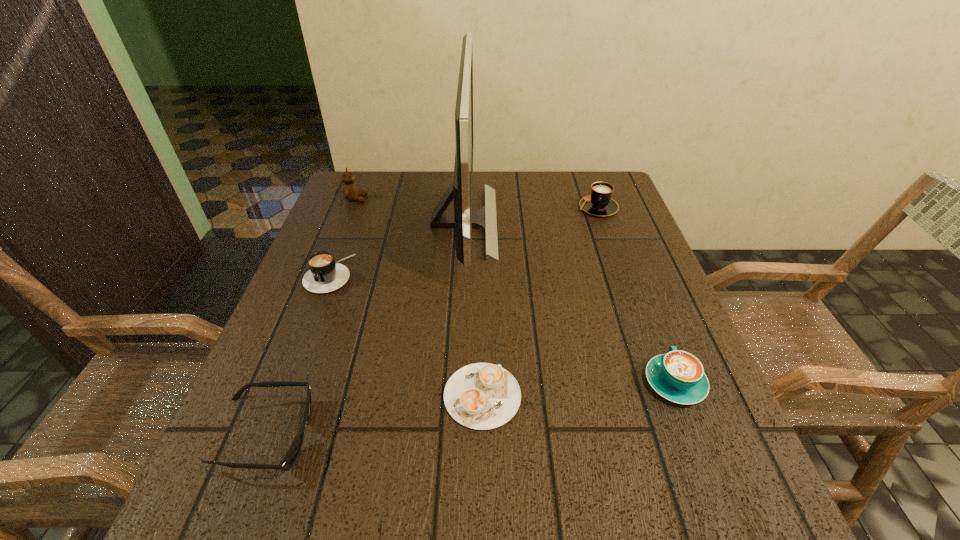
The height and width of the screenshot is (540, 960). I want to click on free region located 0.190m on the front of the farthest cappuccino, so pos(618,266).

The image size is (960, 540). In order to click on vacant space located 0.090m with the handle on the side of the second farthest cappuccino in this screenshot , I will do `click(309, 327)`.

This screenshot has width=960, height=540. I want to click on free space located with the handle on the right side of the second shortest cappuccino, so click(641, 295).

Identify the location of free point located with the handle on the right side of the second shortest cappuccino. Image resolution: width=960 pixels, height=540 pixels. (628, 262).

Locate an element on the screen. This screenshot has width=960, height=540. vacant position located 0.390m with the handle on the right side of the second shortest cappuccino is located at coordinates (617, 234).

Find the location of a particular element. The image size is (960, 540). free space located on the front-facing side of the sunglasses is located at coordinates (355, 436).

Locate an element on the screen. Image resolution: width=960 pixels, height=540 pixels. free region located 0.070m on the front of the shortest object is located at coordinates (483, 474).

Where is `monitor at the far edge`? This screenshot has height=540, width=960. monitor at the far edge is located at coordinates (463, 219).

Locate an element on the screen. Image resolution: width=960 pixels, height=540 pixels. teddy bear located in the far edge section of the desktop is located at coordinates (350, 191).

Where is `cappuccino at the far edge`? The width and height of the screenshot is (960, 540). cappuccino at the far edge is located at coordinates (599, 203).